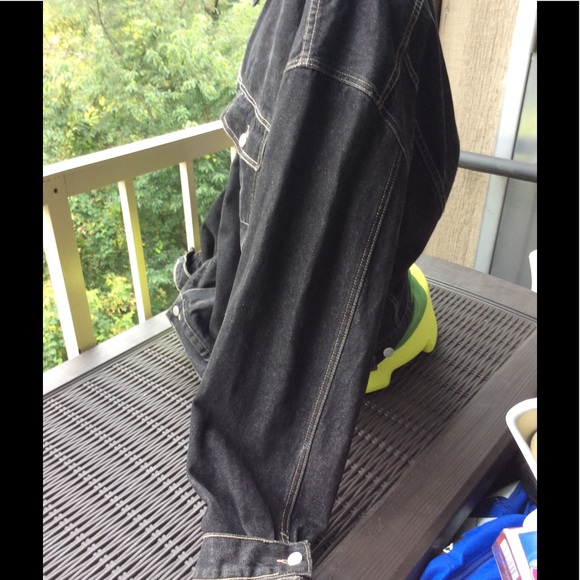
Identify the location of wicker. This screenshot has height=580, width=580. pyautogui.click(x=437, y=371).